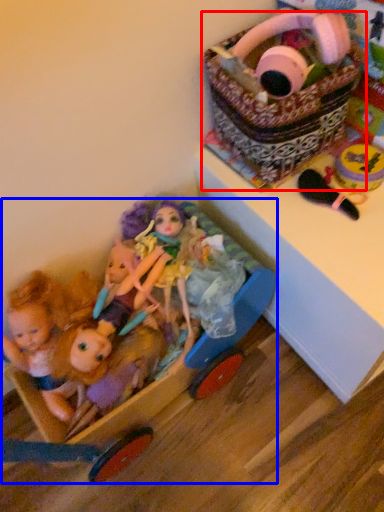
Question: Which object appears closest to the camera in this image, basket (highlighted by a red box) or baby carriage (highlighted by a blue box)?

Choices:
 (A) basket
 (B) baby carriage

Answer: (B)